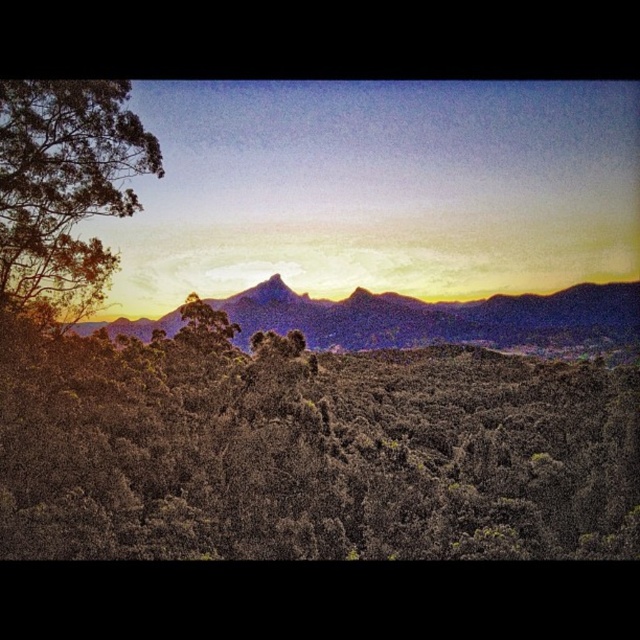
You are standing in the serene landscape scene. You see a green leafy tree at left. Can you estimate its position in the image using coordinates?

The green leafy tree at left is located at coordinates approximately 0.292 on the x axis and 0.102 on the y axis.

You are an artist sketching the landscape. You want to ensure the green leafy tree at left and rugged purple mountain range at center are proportionate. Which object should you draw first to maintain scale?

You should draw the rugged purple mountain range at center first because it is larger than the green leafy tree at left, allowing you to establish the scale before adding smaller elements.